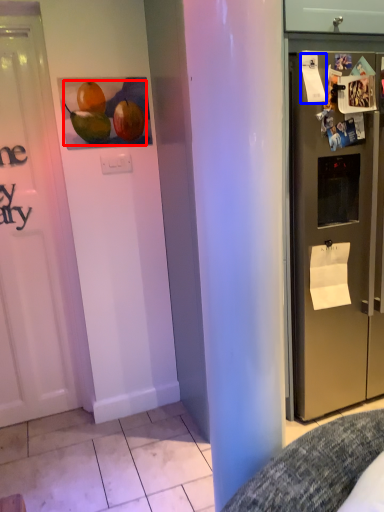
Question: Among these objects, which one is farthest to the camera, fruit (highlighted by a red box) or paper (highlighted by a blue box)?

Choices:
 (A) fruit
 (B) paper

Answer: (A)